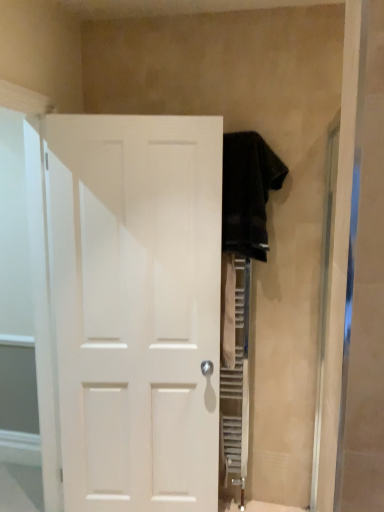
Question: Considering the relative sizes of transparent glass door at left and dark brown towel at upper right in the image provided, is transparent glass door at left smaller than dark brown towel at upper right?

Choices:
 (A) no
 (B) yes

Answer: (A)

Question: Can you confirm if transparent glass door at left is thinner than dark brown towel at upper right?

Choices:
 (A) yes
 (B) no

Answer: (A)

Question: From the image's perspective, is transparent glass door at left on top of dark brown towel at upper right?

Choices:
 (A) yes
 (B) no

Answer: (B)

Question: Considering the relative positions of transparent glass door at left and dark brown towel at upper right in the image provided, is transparent glass door at left in front of dark brown towel at upper right?

Choices:
 (A) yes
 (B) no

Answer: (A)

Question: From a real-world perspective, is transparent glass door at left located beneath dark brown towel at upper right?

Choices:
 (A) no
 (B) yes

Answer: (B)

Question: From a real-world perspective, is transparent glass door at left located higher than dark brown towel at upper right?

Choices:
 (A) yes
 (B) no

Answer: (B)

Question: Is white matte door at center positioned with its back to transparent glass door at left?

Choices:
 (A) no
 (B) yes

Answer: (A)

Question: Is white matte door at center thinner than transparent glass door at left?

Choices:
 (A) no
 (B) yes

Answer: (B)

Question: Considering the relative positions of white matte door at center and transparent glass door at left in the image provided, is white matte door at center to the right of transparent glass door at left from the viewer's perspective?

Choices:
 (A) no
 (B) yes

Answer: (B)

Question: Does white matte door at center appear on the left side of transparent glass door at left?

Choices:
 (A) no
 (B) yes

Answer: (A)

Question: Is white matte door at center further to the viewer compared to transparent glass door at left?

Choices:
 (A) no
 (B) yes

Answer: (B)

Question: Does white matte door at center turn towards transparent glass door at left?

Choices:
 (A) yes
 (B) no

Answer: (B)

Question: Are dark brown towel at upper right and white matte door at center making contact?

Choices:
 (A) yes
 (B) no

Answer: (B)